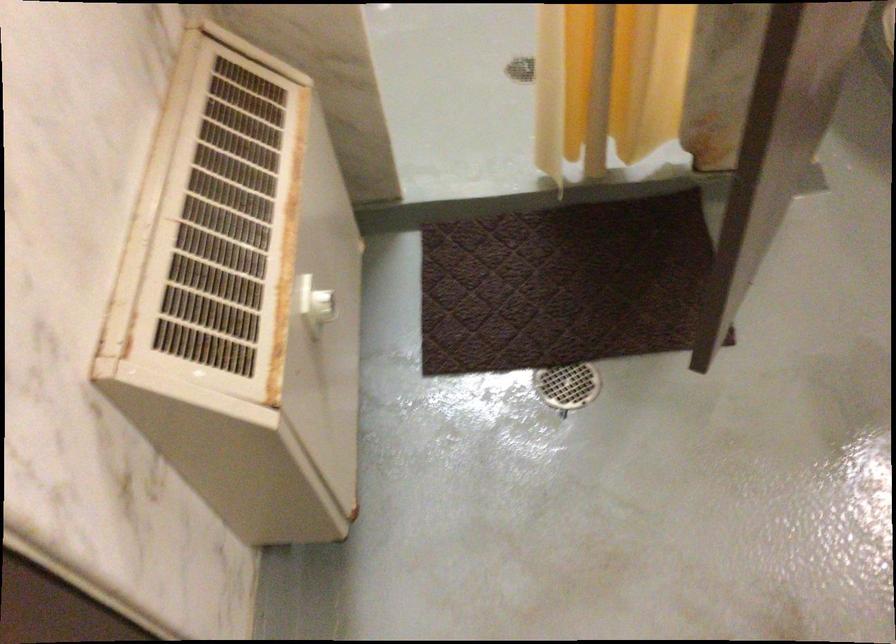
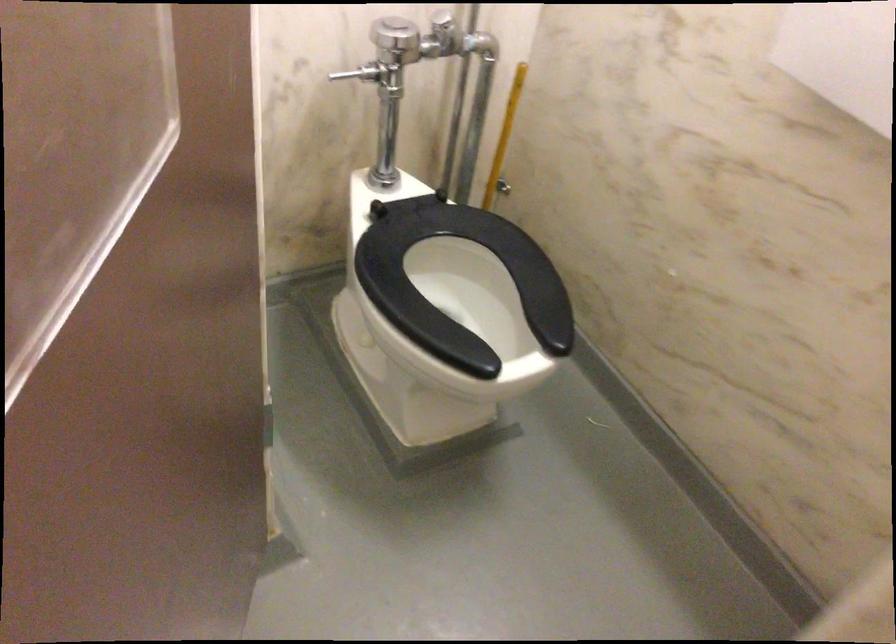
Question: The first image is from the beginning of the video and the second image is from the end. How did the camera likely rotate when shooting the video?

Choices:
 (A) Left
 (B) Right
 (C) Up
 (D) Down

Answer: (B)